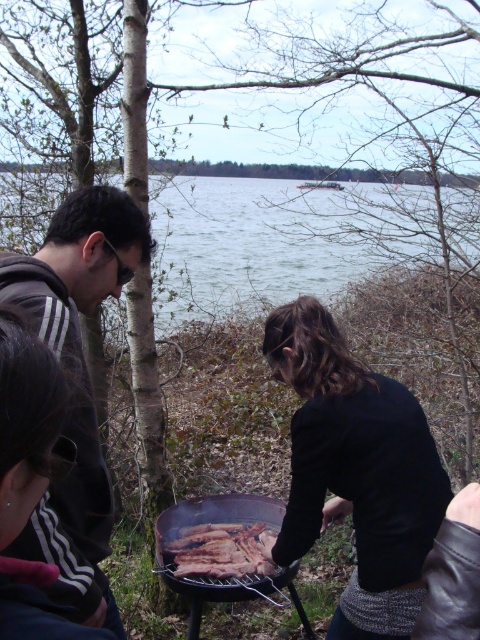
Who is more forward, (302,387) or (111,189)?

A: Positioned in front is point (111,189).

This screenshot has width=480, height=640. What do you see at coordinates (356, 472) in the screenshot?
I see `dark gray sweater at center` at bounding box center [356, 472].

At what (x,y) coordinates should I click in order to perform the action: click on dark gray sweater at center. Please return your answer as a coordinate pair (x, y). The width and height of the screenshot is (480, 640). Looking at the image, I should click on (356, 472).

Between dark gray sweater at center and green water at center, which one is positioned higher?

green water at center

Is dark gray sweater at center to the right of green water at center from the viewer's perspective?

Indeed, dark gray sweater at center is positioned on the right side of green water at center.

Which is behind, point (323, 320) or point (157, 317)?

The point (157, 317) is behind.

Locate an element on the screen. dark gray sweater at center is located at coordinates (356, 472).

Locate an element on the screen. The image size is (480, 640). green water at center is located at coordinates (245, 244).

Which is behind, point (210, 284) or point (273, 566)?

The point (210, 284) is behind.

Image resolution: width=480 pixels, height=640 pixels. I want to click on green water at center, so click(245, 244).